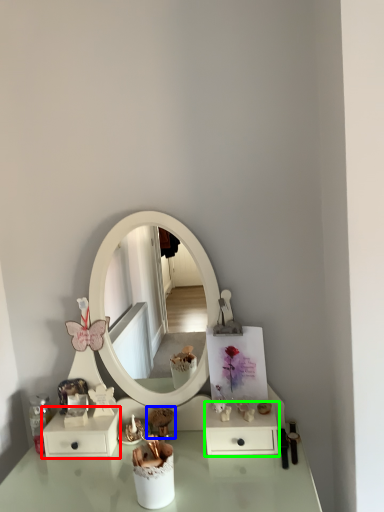
Question: Based on their relative distances, which object is nearer to dresser (highlighted by a red box)? Choose from toy (highlighted by a blue box) and dresser (highlighted by a green box).

Choices:
 (A) toy
 (B) dresser

Answer: (A)